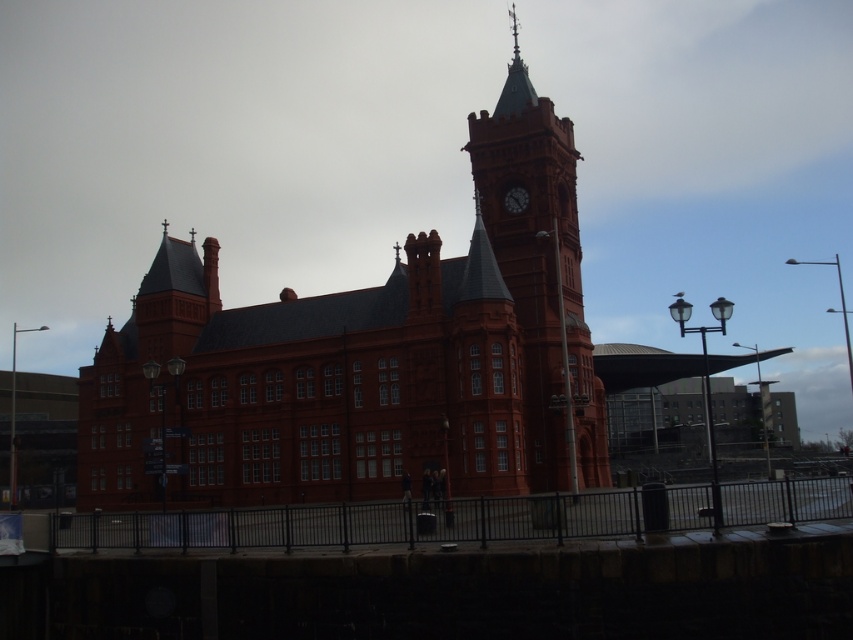
You are standing in front of a grand red brick building with a clock tower. There is a point marked at coordinates point (538, 282). What does this point represent?

The point (538, 282) marks the matte brick clock tower at center.

You are an architect evaluating the proportions of the building. Which object, the matte brick clock tower at center or the dark brown wooden clock at upper center, occupies a larger area in the image?

The matte brick clock tower at center is bigger than the dark brown wooden clock at upper center, so it occupies a larger area in the image.

In the scene shown: You are an architect examining the building and need to determine the spatial relationship between the matte brick clock tower at center and the dark brown wooden clock at upper center. Which object occupies more horizontal space in the image?

The matte brick clock tower at center is wider than the dark brown wooden clock at upper center, so it occupies more horizontal space.